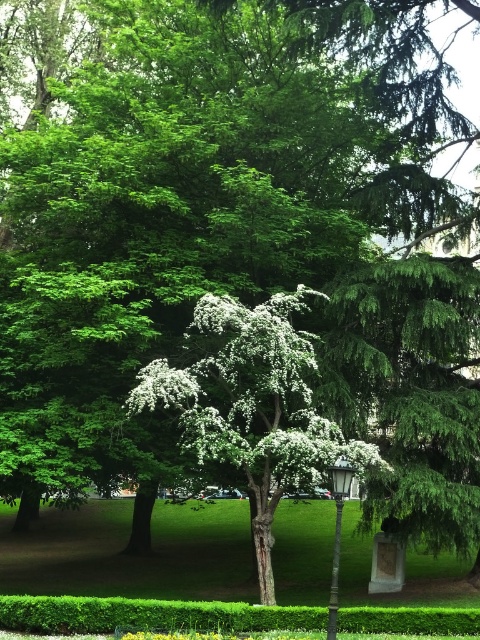
You are standing at the entrance of the park and want to locate the white blossoming tree at center. According to the coordinates provided, in which direction should you walk from the entrance to reach it?

The white blossoming tree at center is located at coordinates point (251, 404). Since the entrance is typically at the bottom left corner of the image, you should walk northeast to reach it.

You are a gardener who needs to water both the white blossoming tree at center and the metallic gray lamp post at center. The watering hose you have can only reach 1.5 meters. Can you water both objects without moving the hose? Please explain your reasoning.

The white blossoming tree at center and the metallic gray lamp post at center are 2.00 meters apart. Since the hose can only reach 1.5 meters, you cannot water both objects without moving the hose because the distance between them exceeds the hose length.

You are a gardener who needs to water both the white blossoming tree at center and the metallic gray lamp post at center. Which object should you water first if you start from the left side of the pathway?

The white blossoming tree at center should be watered first since it is positioned on the left side of the metallic gray lamp post at center, making it closer to the starting point on the left side of the pathway.